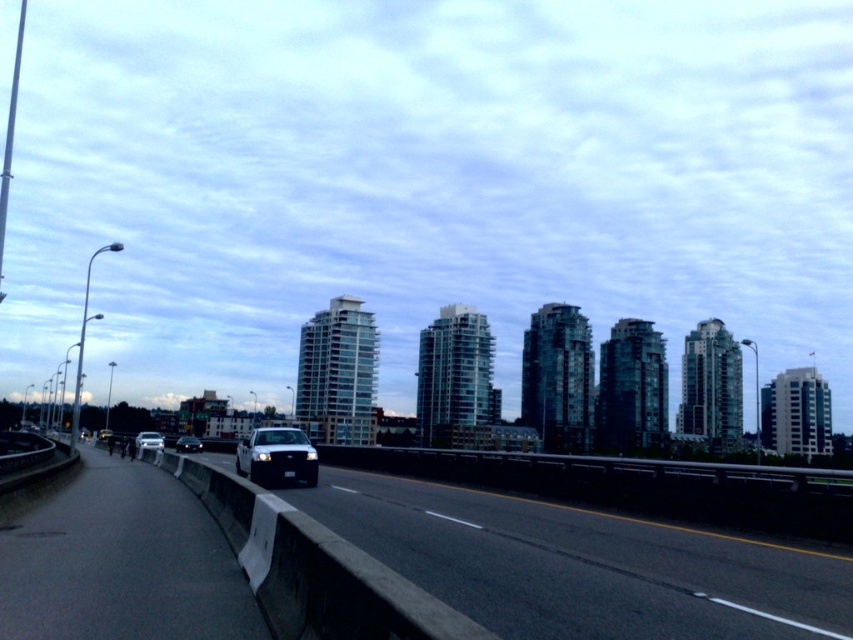
Between silver metallic sedan at center and black glossy sedan at center, which one appears on the right side from the viewer's perspective?

black glossy sedan at center

How much distance is there between silver metallic sedan at center and black glossy sedan at center?

silver metallic sedan at center is 9.49 feet from black glossy sedan at center.

The height and width of the screenshot is (640, 853). What do you see at coordinates (149, 440) in the screenshot? I see `silver metallic sedan at center` at bounding box center [149, 440].

You are a GUI agent. You are given a task and a screenshot of the screen. Output one action in this format:
    pyautogui.click(x=<x>, y=<y>)
    Task: Click on the silver metallic sedan at center
    This screenshot has height=640, width=853.
    Given the screenshot: What is the action you would take?
    [149, 440]

Identify the location of black glossy sedan at center. (189, 444).

What do you see at coordinates (189, 444) in the screenshot?
I see `black glossy sedan at center` at bounding box center [189, 444].

Where is `black glossy sedan at center`? Image resolution: width=853 pixels, height=640 pixels. black glossy sedan at center is located at coordinates (189, 444).

Is point (471, 618) positioned before point (154, 449)?

Yes, it is in front of point (154, 449).

Does point (825, 612) come behind point (136, 444)?

No, it is in front of (136, 444).

Find the location of a particular element. black asphalt highway at center is located at coordinates (581, 564).